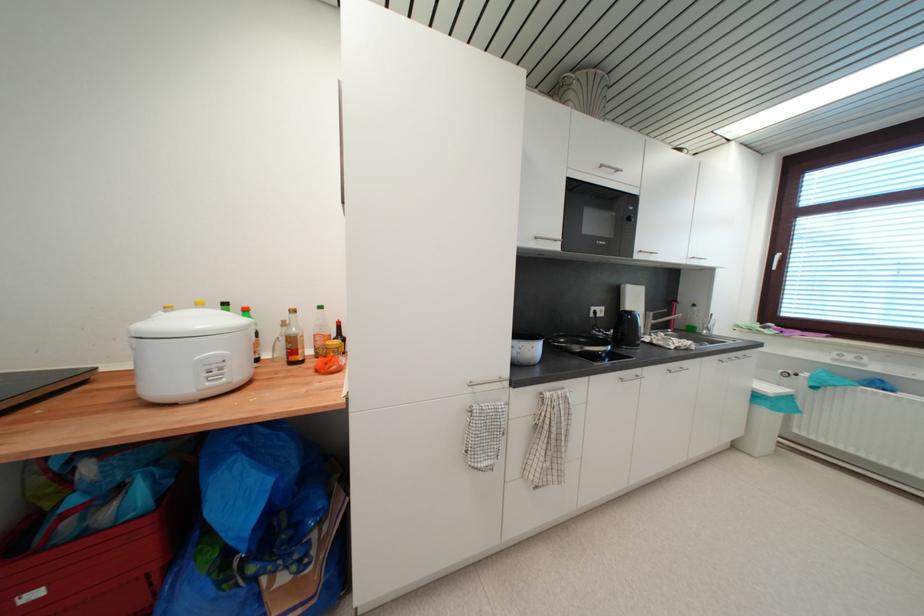
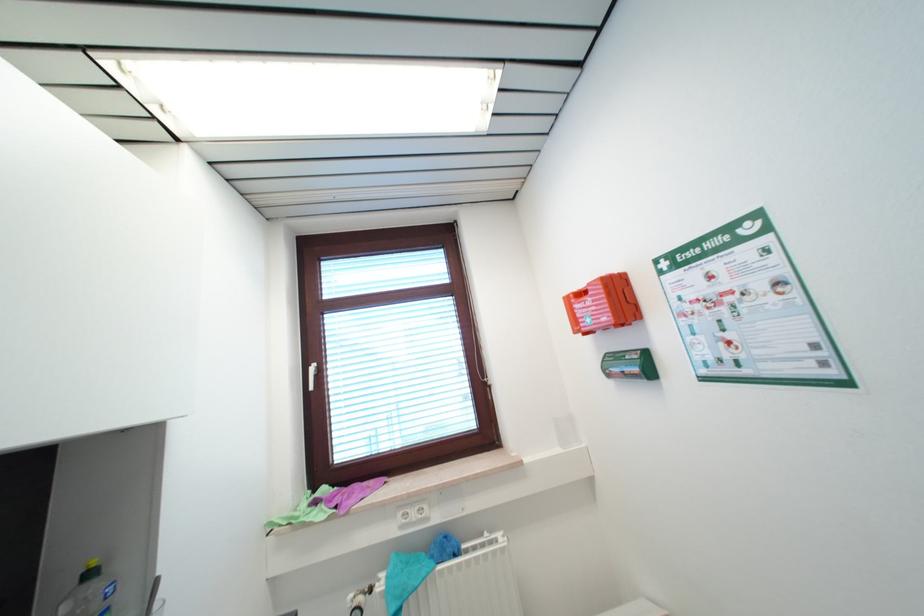
Where in the second image is the point corresponding to [742,328] from the first image?

(274, 525)